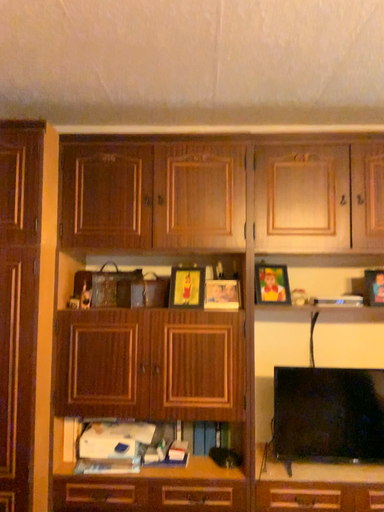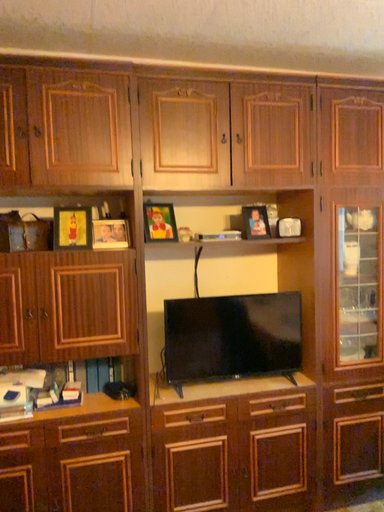
Question: Which way did the camera rotate in the video?

Choices:
 (A) rotated downward
 (B) rotated upward

Answer: (A)